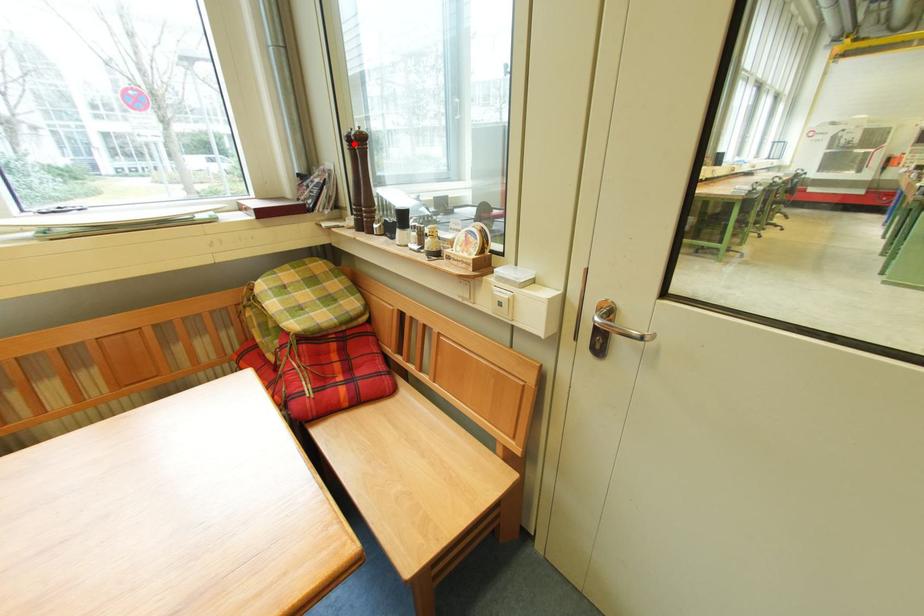
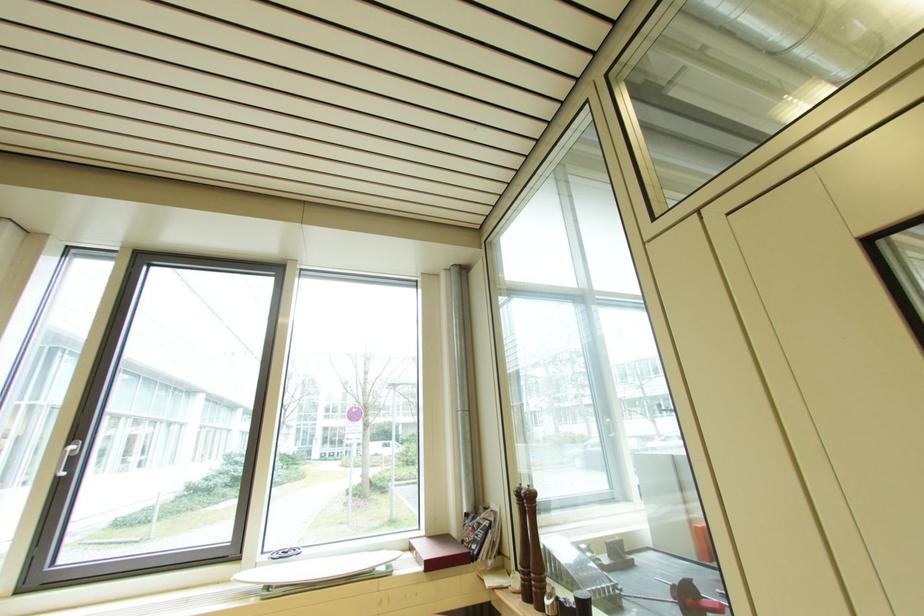
Question: I am providing you with two images of the same scene from different viewpoints. A red point is shown in image1. For the corresponding object point in image2, is it positioned nearer or farther from the camera?

Choices:
 (A) Nearer
 (B) Farther

Answer: (B)